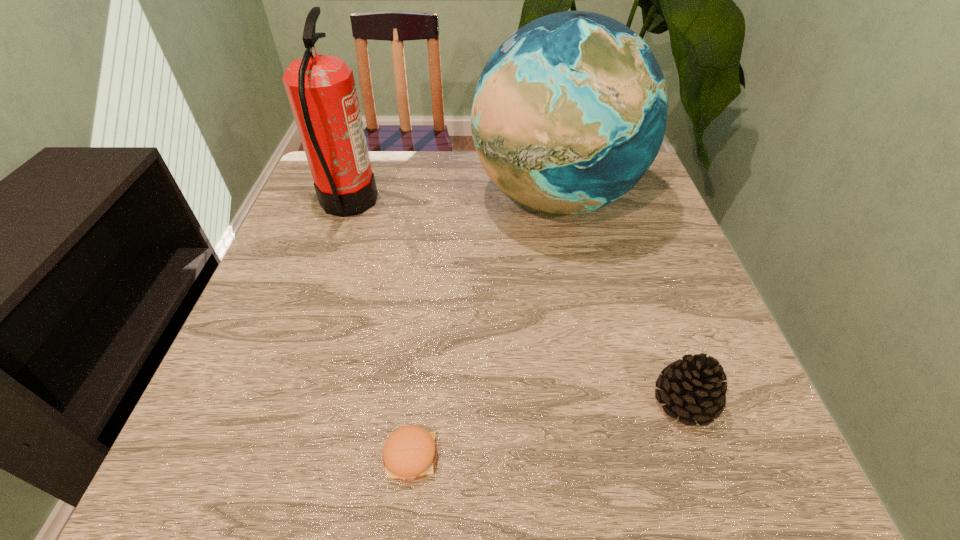
At what (x,y) coordinates should I click in order to perform the action: click on globe. Please return your answer as a coordinate pair (x, y). Image resolution: width=960 pixels, height=540 pixels. Looking at the image, I should click on (569, 113).

I want to click on the leftmost object, so click(x=321, y=89).

I want to click on pinecone, so click(692, 387).

I want to click on the third object from right to left, so point(409,453).

Image resolution: width=960 pixels, height=540 pixels. I want to click on the shortest object, so click(x=409, y=453).

The width and height of the screenshot is (960, 540). In order to click on vacant space positioned 0.090m on the left of the globe in this screenshot , I will do `click(438, 198)`.

Identify the location of vacant space located 0.160m on the front side of the fire extinguisher. This screenshot has height=540, width=960. (437, 203).

Image resolution: width=960 pixels, height=540 pixels. I want to click on free space located 0.370m at the narrow end of the pinecone, so click(x=437, y=401).

Identify the location of vacant position located at the narrow end of the pinecone. (525, 401).

I want to click on free space located 0.080m at the narrow end of the pinecone, so click(x=607, y=401).